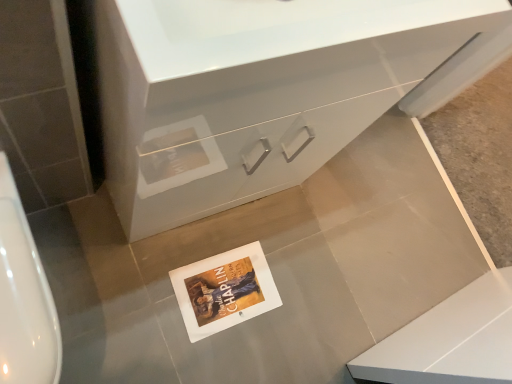
Where is `vacant space situated above white paper postcard at center (from a real-world perspective)`? vacant space situated above white paper postcard at center (from a real-world perspective) is located at coordinates (229, 288).